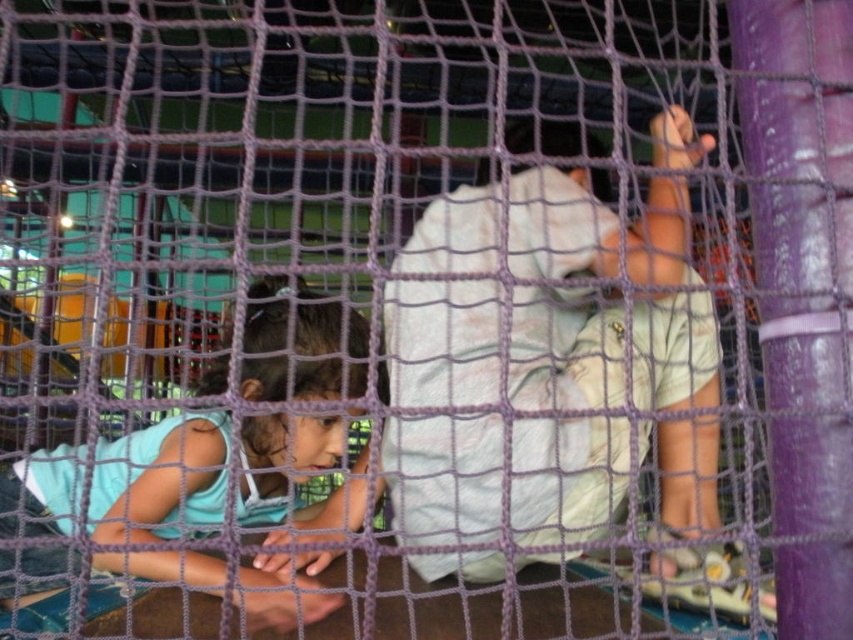
Question: Can you confirm if white cotton shirt at center is smaller than light blue fabric at lower left?

Choices:
 (A) no
 (B) yes

Answer: (A)

Question: Is white cotton shirt at center to the right of light blue fabric at lower left from the viewer's perspective?

Choices:
 (A) no
 (B) yes

Answer: (B)

Question: Which object is farther from the camera taking this photo?

Choices:
 (A) white cotton shirt at center
 (B) light blue fabric at lower left

Answer: (A)

Question: In this image, where is white cotton shirt at center located relative to light blue fabric at lower left?

Choices:
 (A) left
 (B) right

Answer: (B)

Question: Which point is farther from the camera taking this photo?

Choices:
 (A) [463, 435]
 (B) [38, 452]

Answer: (B)

Question: Among these objects, which one is farthest from the camera?

Choices:
 (A) light blue fabric at lower left
 (B) white cotton shirt at center

Answer: (B)